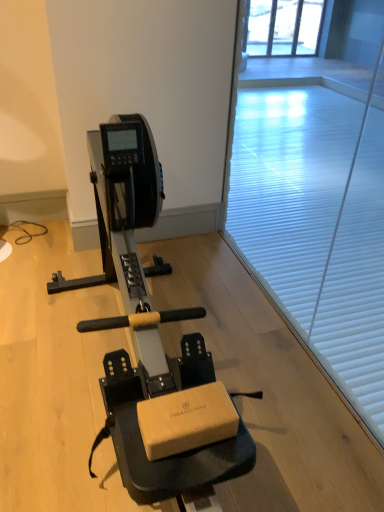
Locate an element on the screen. Image resolution: width=384 pixels, height=512 pixels. vacant space in front of white matte window screen at center is located at coordinates (278, 385).